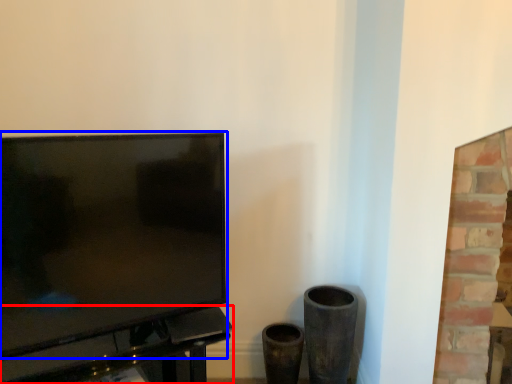
Question: Which point is closer to the camera, table (highlighted by a red box) or television (highlighted by a blue box)?

Choices:
 (A) table
 (B) television

Answer: (B)